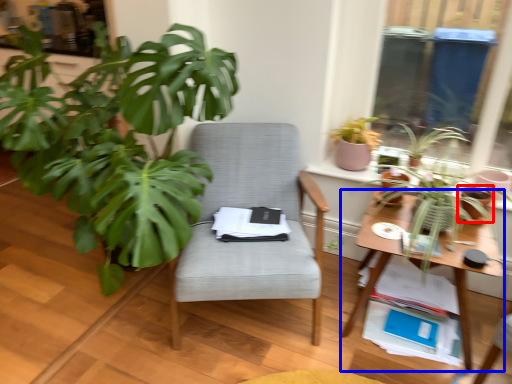
Question: Which of the following is the farthest to the observer, flowerpot (highlighted by a red box) or table (highlighted by a blue box)?

Choices:
 (A) flowerpot
 (B) table

Answer: (A)